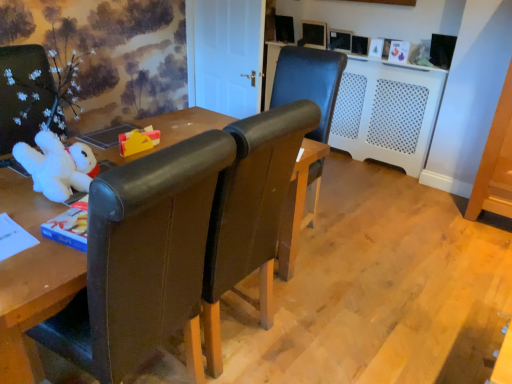
What do you see at coordinates (141, 257) in the screenshot? I see `leather chair at left, the second chair from the back` at bounding box center [141, 257].

Find the location of a particular element. The height and width of the screenshot is (384, 512). white plastic radiator at center is located at coordinates (387, 112).

What are the coordinates of `leather chair at center, placed as the first chair when sorted from right to left` in the screenshot? It's located at (309, 82).

Describe the element at coordinates (309, 82) in the screenshot. I see `leather chair at center, the second chair when ordered from front to back` at that location.

Where is `leather chair at left, positioned as the 1th chair in left-to-right order`? The width and height of the screenshot is (512, 384). leather chair at left, positioned as the 1th chair in left-to-right order is located at coordinates (141, 257).

Between white plush toy at left, which is the second toy in back-to-front order, and leather chair at center, which ranks as the 2th chair in left-to-right order, which one appears on the left side from the viewer's perspective?

white plush toy at left, which is the second toy in back-to-front order.

Looking at the image, does white plush toy at left, which is the second toy in back-to-front order, seem bigger or smaller compared to leather chair at center, placed as the first chair when sorted from right to left?

Considering their sizes, white plush toy at left, which is the second toy in back-to-front order, takes up less space than leather chair at center, placed as the first chair when sorted from right to left.

How different are the orientations of white plush toy at left, which is the second toy in back-to-front order, and leather chair at center, the first chair when ordered from back to front, in degrees?

There is a 89.9-degree angle between the facing directions of white plush toy at left, which is the second toy in back-to-front order, and leather chair at center, the first chair when ordered from back to front.

Can you confirm if leather chair at left, positioned as the 1th chair in front-to-back order, is positioned to the left of white plush toy at left, which is the second toy in back-to-front order?

Incorrect, leather chair at left, positioned as the 1th chair in front-to-back order, is not on the left side of white plush toy at left, which is the second toy in back-to-front order.

Can you confirm if leather chair at left, positioned as the 1th chair in left-to-right order, is shorter than white plush toy at left, which is the second toy in back-to-front order?

In fact, leather chair at left, positioned as the 1th chair in left-to-right order, may be taller than white plush toy at left, which is the second toy in back-to-front order.

From a real-world perspective, is leather chair at left, positioned as the 1th chair in front-to-back order, physically located above or below white plush toy at left, which is the second toy in back-to-front order?

Clearly, from a real-world perspective, leather chair at left, positioned as the 1th chair in front-to-back order, is below white plush toy at left, which is the second toy in back-to-front order.

Which is less distant, (207, 192) or (58, 148)?

The point (207, 192) is more forward.

Does leather chair at center, the second chair when ordered from front to back, lie in front of white plastic radiator at center?

Yes, the depth of leather chair at center, the second chair when ordered from front to back, is less than that of white plastic radiator at center.

Considering the sizes of objects leather chair at center, which ranks as the 2th chair in left-to-right order, and white plastic radiator at center in the image provided, who is thinner, leather chair at center, which ranks as the 2th chair in left-to-right order, or white plastic radiator at center?

Thinner between the two is white plastic radiator at center.

Which object is positioned more to the left, leather chair at center, the second chair when ordered from front to back, or white plastic radiator at center?

leather chair at center, the second chair when ordered from front to back.

Is point (273, 96) more distant than point (335, 140)?

That is False.

How far apart are white plastic radiator at center and leather chair at center, which ranks as the 2th chair in left-to-right order?

white plastic radiator at center is 28.24 inches away from leather chair at center, which ranks as the 2th chair in left-to-right order.

Does white plastic radiator at center come behind leather chair at center, the first chair when ordered from back to front?

Yes, white plastic radiator at center is further from the viewer.

Would you say white plastic radiator at center is inside or outside leather chair at center, placed as the first chair when sorted from right to left?

white plastic radiator at center cannot be found inside leather chair at center, placed as the first chair when sorted from right to left.

From the white plastic radiator at center, count 1st chairs forward and point to it. Please provide its 2D coordinates.

[(309, 82)]

Considering the positions of objects matte yellow toy at center, placed as the 2th toy when sorted from front to back, and white plush toy at left, which is the second toy in back-to-front order, in the image provided, who is behind, matte yellow toy at center, placed as the 2th toy when sorted from front to back, or white plush toy at left, which is the second toy in back-to-front order,?

matte yellow toy at center, placed as the 2th toy when sorted from front to back, is behind.

Which point is more forward, (141, 139) or (83, 149)?

The point (83, 149) is in front.

In the image, there is a white plush toy at left, which is the second toy in back-to-front order. Identify the location of toy above it (from the image's perspective). (138, 140).

Can white plush toy at left, the 1th toy in the front-to-back sequence, be found inside matte yellow toy at center, arranged as the first toy when viewed from the back?

No, white plush toy at left, the 1th toy in the front-to-back sequence, is located outside of matte yellow toy at center, arranged as the first toy when viewed from the back.

Does matte yellow toy at center, placed as the 2th toy when sorted from front to back, have a larger size compared to white plastic radiator at center?

No.

Is point (119, 137) farther from camera compared to point (422, 142)?

No, it is not.

Which object is closer to the camera, matte yellow toy at center, arranged as the first toy when viewed from the back, or white plastic radiator at center?

matte yellow toy at center, arranged as the first toy when viewed from the back.

From a real-world perspective, which object rests below the other?

In real-world perspective, white plastic radiator at center is lower.

Looking at this image, which object is further away from the camera, white plastic radiator at center or white plush toy at left, which is the second toy in back-to-front order?

white plastic radiator at center.

Identify the location of computer desk below the white plush toy at left, the 1th toy in the front-to-back sequence (from a real-world perspective). (387, 112).

Is white plastic radiator at center facing towards white plush toy at left, which is the second toy in back-to-front order?

Yes.

In terms of height, does white plastic radiator at center look taller or shorter compared to white plush toy at left, the 1th toy in the front-to-back sequence?

white plastic radiator at center is taller than white plush toy at left, the 1th toy in the front-to-back sequence.

You are a GUI agent. You are given a task and a screenshot of the screen. Output one action in this format:
    pyautogui.click(x=<x>, y=<y>)
    Task: Click on the toy that is the 2nd one when counting leftward from the leather chair at center, the first chair when ordered from back to front
    This screenshot has width=512, height=384.
    Given the screenshot: What is the action you would take?
    pyautogui.click(x=57, y=166)

Image resolution: width=512 pixels, height=384 pixels. Identify the location of chair that appears in front of the white plush toy at left, which is the second toy in back-to-front order. (141, 257).

Which object lies further to the anchor point leather chair at left, positioned as the 1th chair in left-to-right order, white plastic radiator at center or white plush toy at left, which is the second toy in back-to-front order?

Among the two, white plastic radiator at center is located further to leather chair at left, positioned as the 1th chair in left-to-right order.

Considering their positions, is matte yellow toy at center, placed as the 2th toy when sorted from front to back, positioned further to white plush toy at left, which is the second toy in back-to-front order, than white plastic radiator at center?

The object further to white plush toy at left, which is the second toy in back-to-front order, is white plastic radiator at center.

When comparing their distances from leather chair at left, which is the second chair from right to left, does white plush toy at left, the 1th toy in the front-to-back sequence, or leather chair at center, the first chair when ordered from back to front, seem closer?

Based on the image, white plush toy at left, the 1th toy in the front-to-back sequence, appears to be nearer to leather chair at left, which is the second chair from right to left.

Which object lies nearer to the anchor point leather chair at left, the second chair from the back, white plush toy at left, the 1th toy in the front-to-back sequence, or white plastic radiator at center?

Based on the image, white plush toy at left, the 1th toy in the front-to-back sequence, appears to be nearer to leather chair at left, the second chair from the back.

Which object lies further to the anchor point leather chair at center, the first chair when ordered from back to front, white plush toy at left, which is the second toy in back-to-front order, or white plastic radiator at center?

Among the two, white plush toy at left, which is the second toy in back-to-front order, is located further to leather chair at center, the first chair when ordered from back to front.

Looking at the image, which one is located further to white plastic radiator at center, matte yellow toy at center, arranged as the first toy when viewed from the back, or leather chair at left, which is the second chair from right to left?

The object further to white plastic radiator at center is leather chair at left, which is the second chair from right to left.

Looking at the image, which one is located closer to white plastic radiator at center, leather chair at center, the first chair when ordered from back to front, or white plush toy at left, which is the second toy in back-to-front order?

leather chair at center, the first chair when ordered from back to front, lies closer to white plastic radiator at center than the other object.

Based on the photo, based on their spatial positions, is matte yellow toy at center, arranged as the first toy when viewed from the back, or leather chair at left, which is the second chair from right to left, further from white plush toy at left, which is the second toy in back-to-front order?

leather chair at left, which is the second chair from right to left, lies further to white plush toy at left, which is the second toy in back-to-front order, than the other object.

You are a GUI agent. You are given a task and a screenshot of the screen. Output one action in this format:
    pyautogui.click(x=<x>, y=<y>)
    Task: Click on the toy located between white plush toy at left, which is the second toy in back-to-front order, and leather chair at center, which ranks as the 2th chair in left-to-right order, in the left-right direction
    The width and height of the screenshot is (512, 384).
    Given the screenshot: What is the action you would take?
    pyautogui.click(x=138, y=140)

Where is `chair located between white plush toy at left, the 1th toy in the front-to-back sequence, and white plastic radiator at center in the depth direction`? The height and width of the screenshot is (384, 512). chair located between white plush toy at left, the 1th toy in the front-to-back sequence, and white plastic radiator at center in the depth direction is located at coordinates (309, 82).

Where is `toy between leather chair at left, the second chair from the back, and matte yellow toy at center, placed as the 2th toy when sorted from front to back, along the z-axis`? Image resolution: width=512 pixels, height=384 pixels. toy between leather chair at left, the second chair from the back, and matte yellow toy at center, placed as the 2th toy when sorted from front to back, along the z-axis is located at coordinates (57, 166).

You are a GUI agent. You are given a task and a screenshot of the screen. Output one action in this format:
    pyautogui.click(x=<x>, y=<y>)
    Task: Click on the chair located between leather chair at left, positioned as the 1th chair in front-to-back order, and white plastic radiator at center in the depth direction
    The height and width of the screenshot is (384, 512).
    Given the screenshot: What is the action you would take?
    click(309, 82)